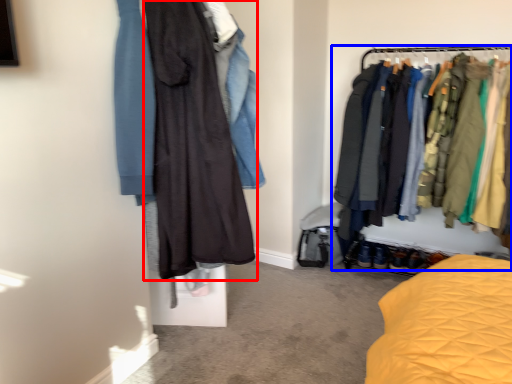
Question: Among these objects, which one is nearest to the camera, fancy dress (highlighted by a red box) or closet (highlighted by a blue box)?

Choices:
 (A) fancy dress
 (B) closet

Answer: (A)